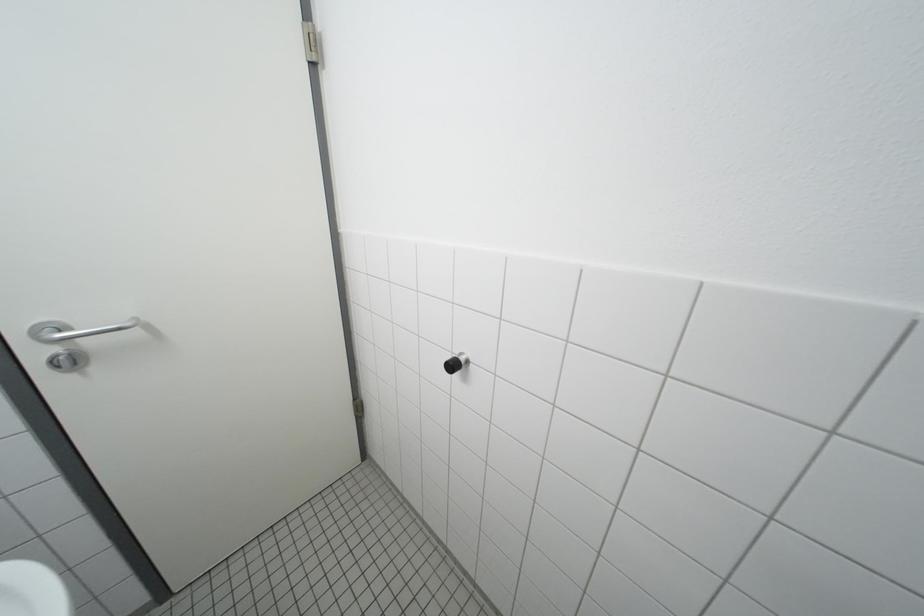
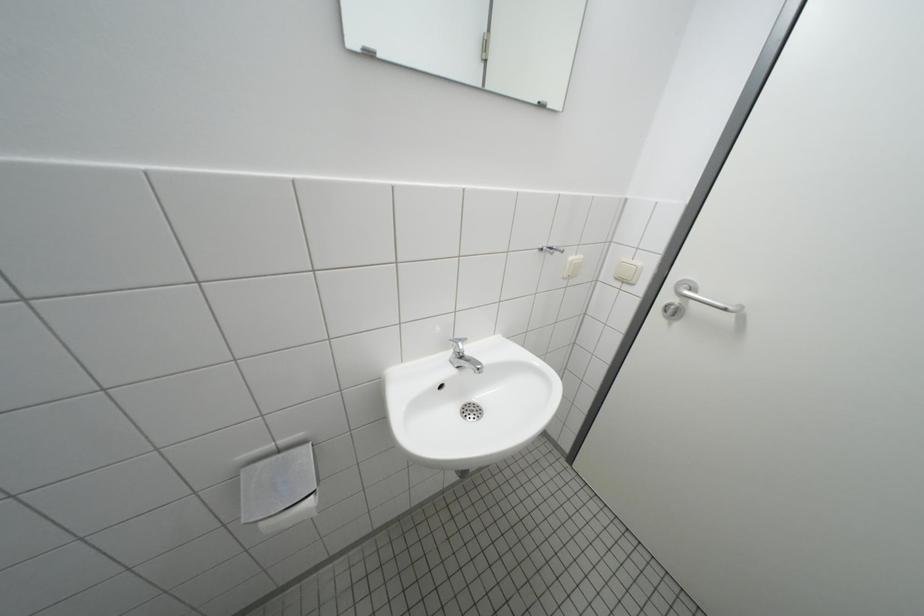
First-person continuous shooting, in which direction is the camera rotating?

The camera's rotation is toward left-down.